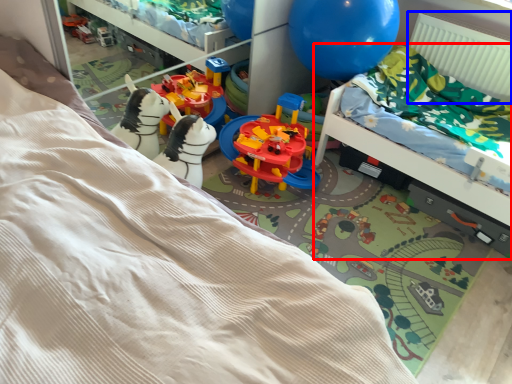
Question: Among these objects, which one is nearest to the camera, hospital bed (highlighted by a red box) or radiator (highlighted by a blue box)?

Choices:
 (A) hospital bed
 (B) radiator

Answer: (A)